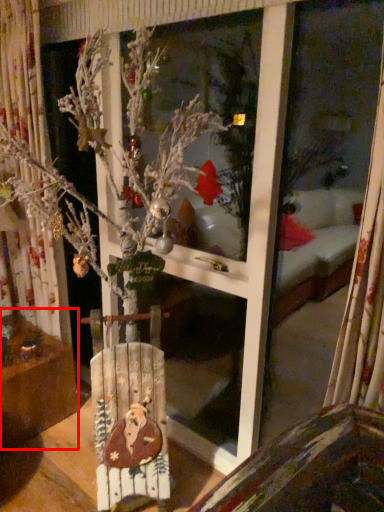
Question: From the image, what is the correct spatial relationship of furniture (annotated by the red box) in relation to armchair?

Choices:
 (A) left
 (B) right

Answer: (A)